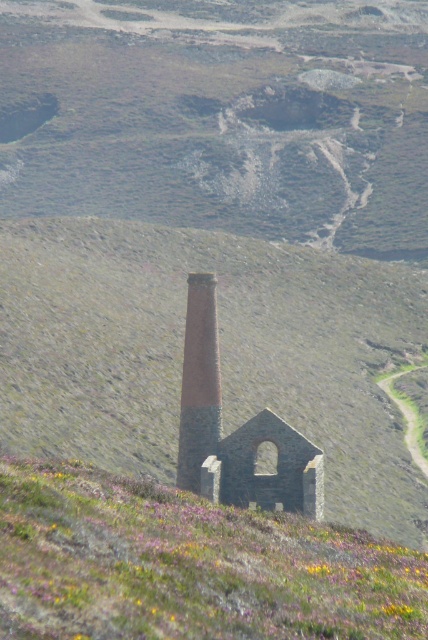
Looking at this image, you are a hiker who has reached the summit of a hill and sees the stone chimney at center and the rustic stone tower at center. Which structure is higher from your viewpoint?

The stone chimney at center is positioned over rustic stone tower at center, so the stone chimney at center is higher from your viewpoint.